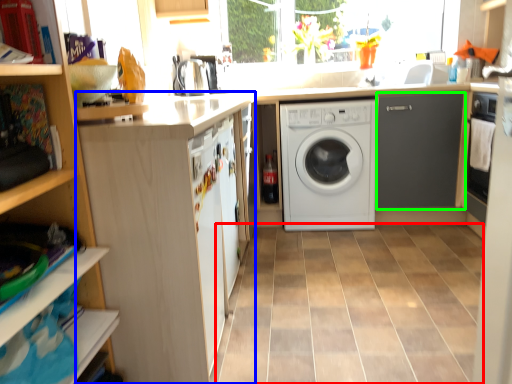
Question: Which is farther away from ceramic tile (highlighted by a red box)? cabinetry (highlighted by a blue box) or cabinetry (highlighted by a green box)?

Choices:
 (A) cabinetry
 (B) cabinetry

Answer: (B)